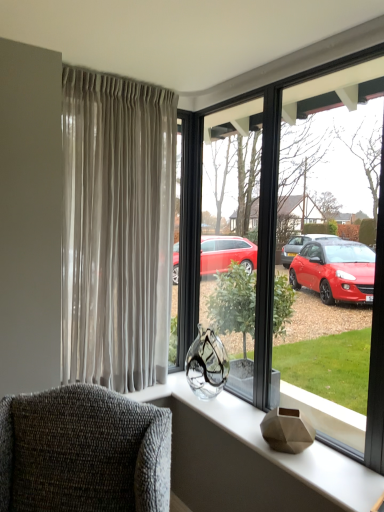
What do you see at coordinates (254, 462) in the screenshot?
I see `matte gray vase at center` at bounding box center [254, 462].

The image size is (384, 512). Describe the element at coordinates (83, 452) in the screenshot. I see `textured gray armchair at lower left` at that location.

The height and width of the screenshot is (512, 384). Describe the element at coordinates (116, 229) in the screenshot. I see `satin beige curtains at left` at that location.

At what (x,y) coordinates should I click in order to perform the action: click on matte gray vase at center. Please return your answer as a coordinate pair (x, y). The height and width of the screenshot is (512, 384). Looking at the image, I should click on click(254, 462).

Which object is more forward, textured gray armchair at lower left or matte gray vase at center?

textured gray armchair at lower left is closer to the camera.

Is textured gray armchair at lower left wider than matte gray vase at center?

Correct, the width of textured gray armchair at lower left exceeds that of matte gray vase at center.

What's the angular difference between textured gray armchair at lower left and matte gray vase at center's facing directions?

48.9 degrees.

Consider the image. Considering the relative positions of satin beige curtains at left and textured gray armchair at lower left in the image provided, is satin beige curtains at left to the right of textured gray armchair at lower left from the viewer's perspective?

Correct, you'll find satin beige curtains at left to the right of textured gray armchair at lower left.

From a real-world perspective, is satin beige curtains at left physically above textured gray armchair at lower left?

Yes, from a real-world perspective, satin beige curtains at left is on top of textured gray armchair at lower left.

What's the angular difference between satin beige curtains at left and textured gray armchair at lower left's facing directions?

They differ by 41.4 degrees in their facing directions.

Choose the correct answer: Is satin beige curtains at left inside matte gray vase at center or outside it?

satin beige curtains at left is located beyond the bounds of matte gray vase at center.

Can you confirm if satin beige curtains at left is wider than matte gray vase at center?

Incorrect, the width of satin beige curtains at left does not surpass that of matte gray vase at center.

Between satin beige curtains at left and matte gray vase at center, which one has more height?

With more height is satin beige curtains at left.

Is satin beige curtains at left positioned in front of matte gray vase at center?

No, it is not.

Is textured gray armchair at lower left beside transparent glass vase at center?

No, textured gray armchair at lower left is not next to transparent glass vase at center.

Between textured gray armchair at lower left and transparent glass vase at center, which one appears on the right side from the viewer's perspective?

Positioned to the right is transparent glass vase at center.

Considering the sizes of objects textured gray armchair at lower left and transparent glass vase at center in the image provided, who is taller, textured gray armchair at lower left or transparent glass vase at center?

Standing taller between the two is transparent glass vase at center.

Who is bigger, textured gray armchair at lower left or transparent glass vase at center?

Bigger between the two is textured gray armchair at lower left.

Is transparent glass vase at center turned away from textured gray armchair at lower left?

That's not correct — transparent glass vase at center is not looking away from textured gray armchair at lower left.

Does transparent glass vase at center have a larger size compared to textured gray armchair at lower left?

No, transparent glass vase at center is not bigger than textured gray armchair at lower left.

Can you see transparent glass vase at center touching textured gray armchair at lower left?

transparent glass vase at center and textured gray armchair at lower left are not in contact.

Identify the location of window that appears on the right of textured gray armchair at lower left. The width and height of the screenshot is (384, 512). (296, 236).

Which of these two, matte gray vase at center or transparent glass vase at center, stands shorter?

With less height is matte gray vase at center.

Could you tell me if matte gray vase at center is turned towards transparent glass vase at center?

No, matte gray vase at center is not oriented towards transparent glass vase at center.

What are the coordinates of `window behind the matte gray vase at center` in the screenshot? It's located at (296, 236).

How different are the orientations of matte gray vase at center and transparent glass vase at center in degrees?

The facing directions of matte gray vase at center and transparent glass vase at center are 0.000838 degrees apart.

How many degrees apart are the facing directions of transparent glass vase at center and satin beige curtains at left?

90.3 degrees.

Which object is wider, transparent glass vase at center or satin beige curtains at left?

Wider between the two is satin beige curtains at left.

From the picture: Is transparent glass vase at center next to satin beige curtains at left and touching it?

transparent glass vase at center and satin beige curtains at left are not in contact.

Is transparent glass vase at center facing away from satin beige curtains at left?

No, satin beige curtains at left is not at the back of transparent glass vase at center.

The image size is (384, 512). I want to click on window sill that appears behind the textured gray armchair at lower left, so click(254, 462).

The width and height of the screenshot is (384, 512). Find the location of `chair in front of the satin beige curtains at left`. chair in front of the satin beige curtains at left is located at coordinates (83, 452).

Looking at the image, which one is located closer to textured gray armchair at lower left, matte gray vase at center or transparent glass vase at center?

Based on the image, matte gray vase at center appears to be nearer to textured gray armchair at lower left.

When comparing their distances from transparent glass vase at center, does matte gray vase at center or satin beige curtains at left seem closer?

satin beige curtains at left is positioned closer to the anchor transparent glass vase at center.

Based on the photo, estimate the real-world distances between objects in this image. Which object is further from textured gray armchair at lower left, matte gray vase at center or satin beige curtains at left?

Among the two, satin beige curtains at left is located further to textured gray armchair at lower left.

When comparing their distances from transparent glass vase at center, does textured gray armchair at lower left or matte gray vase at center seem further?

textured gray armchair at lower left.

Based on their spatial positions, is textured gray armchair at lower left or matte gray vase at center closer to satin beige curtains at left?

textured gray armchair at lower left is positioned closer to the anchor satin beige curtains at left.

Which object lies further to the anchor point textured gray armchair at lower left, transparent glass vase at center or satin beige curtains at left?

The object further to textured gray armchair at lower left is transparent glass vase at center.

Considering their positions, is textured gray armchair at lower left positioned further to matte gray vase at center than transparent glass vase at center?

transparent glass vase at center.

Based on their spatial positions, is satin beige curtains at left or matte gray vase at center further from transparent glass vase at center?

matte gray vase at center is further to transparent glass vase at center.

At what (x,y) coordinates should I click in order to perform the action: click on chair between transparent glass vase at center and matte gray vase at center in the vertical direction. Please return your answer as a coordinate pair (x, y). Looking at the image, I should click on (83, 452).

I want to click on window sill positioned between textured gray armchair at lower left and satin beige curtains at left from near to far, so click(x=254, y=462).

Find the location of `window positioned between textured gray armchair at lower left and satin beige curtains at left from near to far`. window positioned between textured gray armchair at lower left and satin beige curtains at left from near to far is located at coordinates (296, 236).

The width and height of the screenshot is (384, 512). Find the location of `window between satin beige curtains at left and matte gray vase at center vertically`. window between satin beige curtains at left and matte gray vase at center vertically is located at coordinates (296, 236).